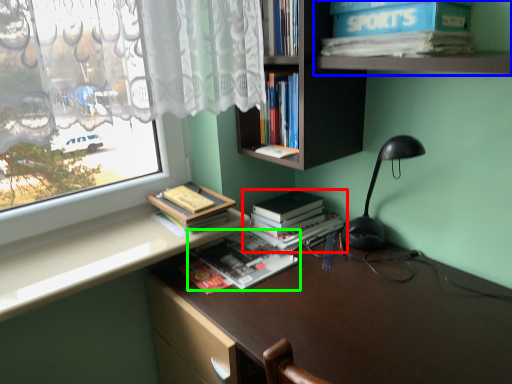
Question: Which object is the farthest from book (highlighted by a red box)? Choose among these: shelf (highlighted by a blue box) or book (highlighted by a green box).

Choices:
 (A) shelf
 (B) book

Answer: (A)